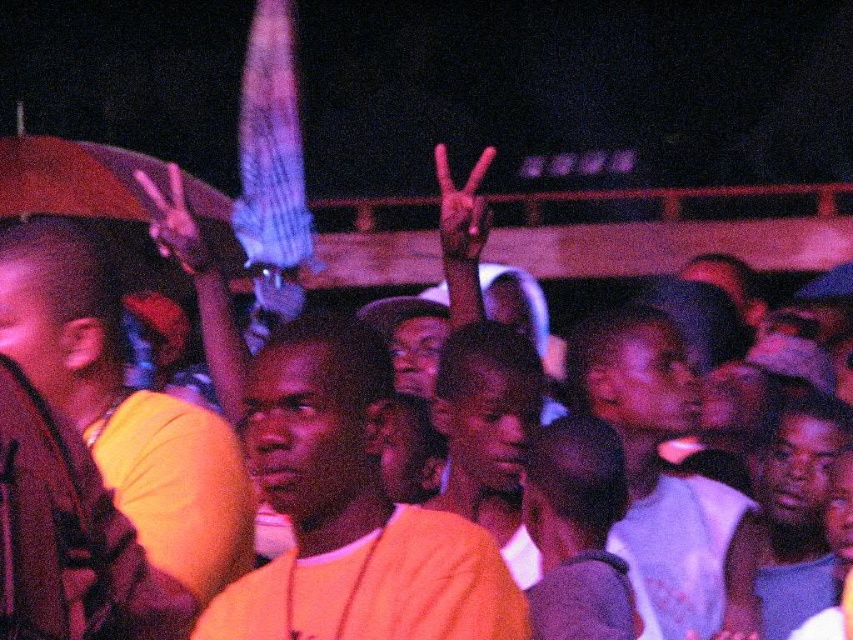
You are standing at the origin point in the center of the image. You see two points marked in the image. Which point is closer to you, point (x=350, y=600) or point (x=662, y=627)?

Point (x=350, y=600) is in front of point (x=662, y=627), so it is closer to you.

You are at a crowded event and see two people wearing orange cotton shirt at center and white cotton shirt at center. Which one is more to the left?

The orange cotton shirt at center is more to the left than the white cotton shirt at center.

You are at a crowded event and need to spot two people wearing orange cotton shirt at center and white cotton shirt at center. Which one is shorter?

The orange cotton shirt at center is shorter than the white cotton shirt at center.